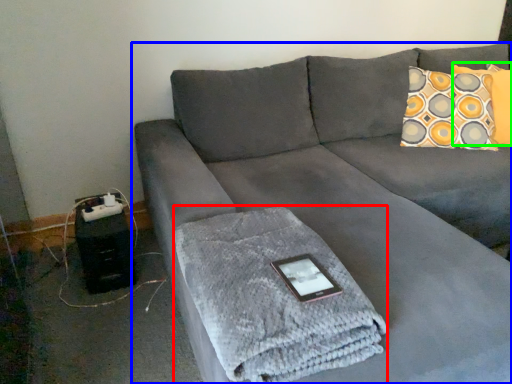
Question: Which object is the farthest from bath towel (highlighted by a red box)? Choose among these: studio couch (highlighted by a blue box) or pillow (highlighted by a green box).

Choices:
 (A) studio couch
 (B) pillow

Answer: (B)